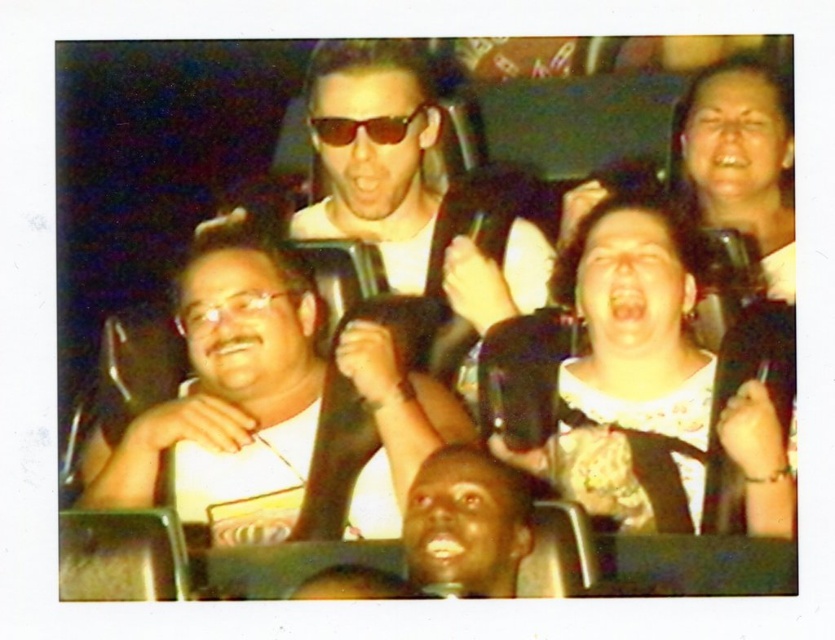
You are a photographer trying to capture a closeup shot of the white matte shirt at center and the matte black goggles at center. Your camera has a minimum focus distance of 10 inches. Will you be able to focus on both objects simultaneously?

The white matte shirt at center is 9.61 inches away from the matte black goggles at center, which is less than the camera minimum focus distance of 10 inches. Therefore, the camera cannot focus on both objects simultaneously.

You are on a roller coaster ride and want to know if the point at coordinates point (262, 470) is closer to you than point (183, 324). Can you determine this based on your current position?

Yes, point (262, 470) is in front of point (183, 324), so it is closer to you.

You are a photographer trying to capture a clear photo of the matte black goggles at center and the smooth skin face at lower center. Which object should you focus on first to ensure both are in focus?

The smooth skin face at lower center is in front of the matte black goggles at center. To ensure both are in focus, you should focus on the smooth skin face at lower center first, as it is closer to the camera.